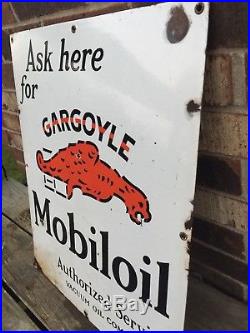
In order to click on boards in wooden table in this screenshot , I will do [14, 317], [21, 206], [13, 248].